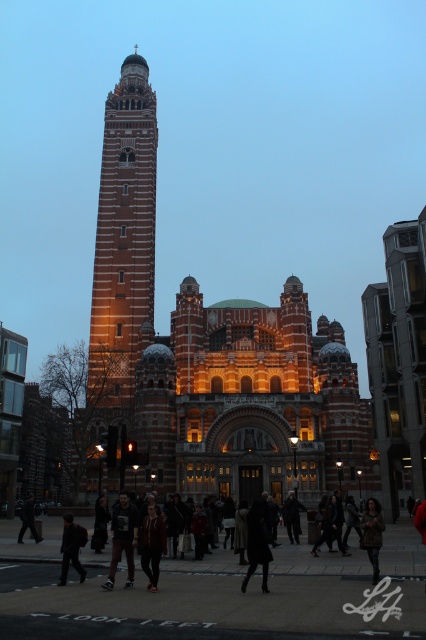
You are standing in front of the grand illuminated building and see two jackets. The dark brown leather jacket at lower center and the dark gray jacket at lower left. Which jacket is taller?

The dark brown leather jacket at lower center is much taller as the dark gray jacket at lower left.

You are a photographer standing at the entrance of the building. You want to capture a photo that includes both the brick tower at center and the dark gray coat at lower left. Which object should you position closer to the edge of the frame to ensure both fit in the shot?

Since the brick tower at center is wider than the dark gray coat at lower left, you should position the brick tower at center closer to the edge of the frame to ensure both fit in the shot.